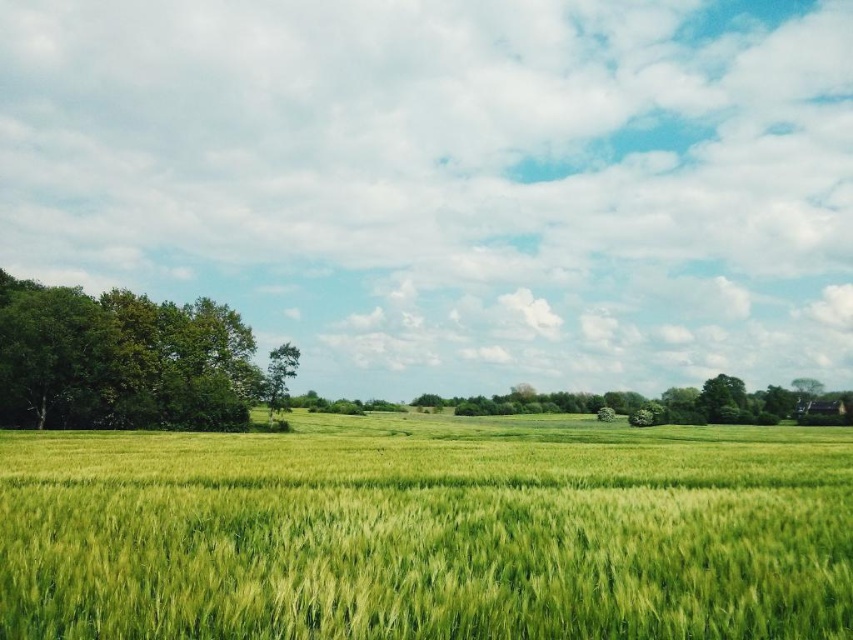
Who is more forward, (65, 321) or (265, 401)?

Point (65, 321) is in front.

Which is behind, point (91, 408) or point (268, 374)?

The point (268, 374) is more distant.

The width and height of the screenshot is (853, 640). What are the coordinates of `green leafy tree at left` in the screenshot? It's located at (120, 360).

Who is positioned more to the left, green grassy wheat field at center or green leafy tree at center-left?

From the viewer's perspective, green leafy tree at center-left appears more on the left side.

This screenshot has width=853, height=640. Find the location of `green grassy wheat field at center`. green grassy wheat field at center is located at coordinates (428, 532).

Find the location of a particular element. The height and width of the screenshot is (640, 853). green grassy wheat field at center is located at coordinates (428, 532).

Who is positioned more to the left, green grassy wheat field at center or green leafy tree at left?

Positioned to the left is green leafy tree at left.

Is point (4, 634) closer to viewer compared to point (172, 333)?

Yes.

Between point (113, 448) and point (30, 387), which one is positioned behind?

The point (30, 387) is behind.

Find the location of a particular element. This screenshot has height=640, width=853. green grassy wheat field at center is located at coordinates (428, 532).